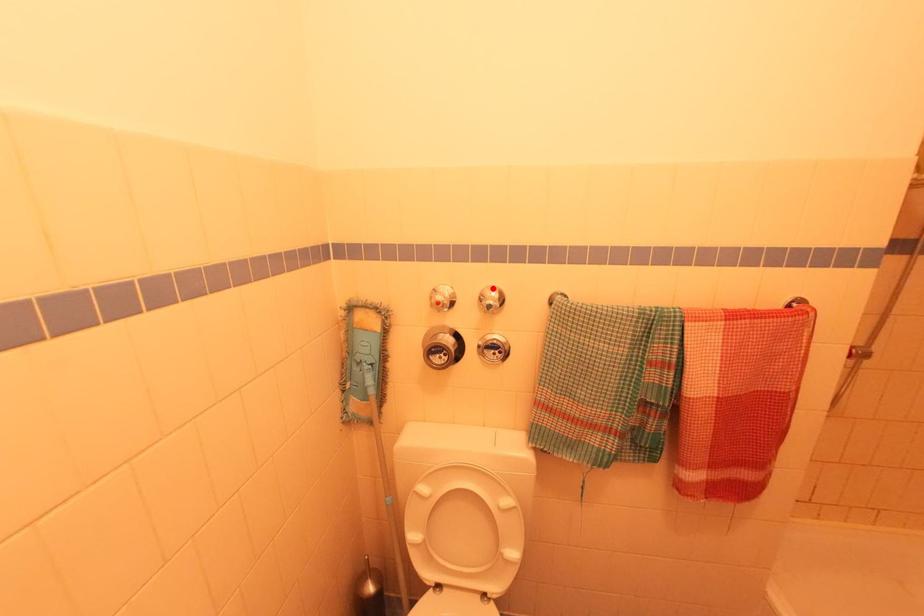
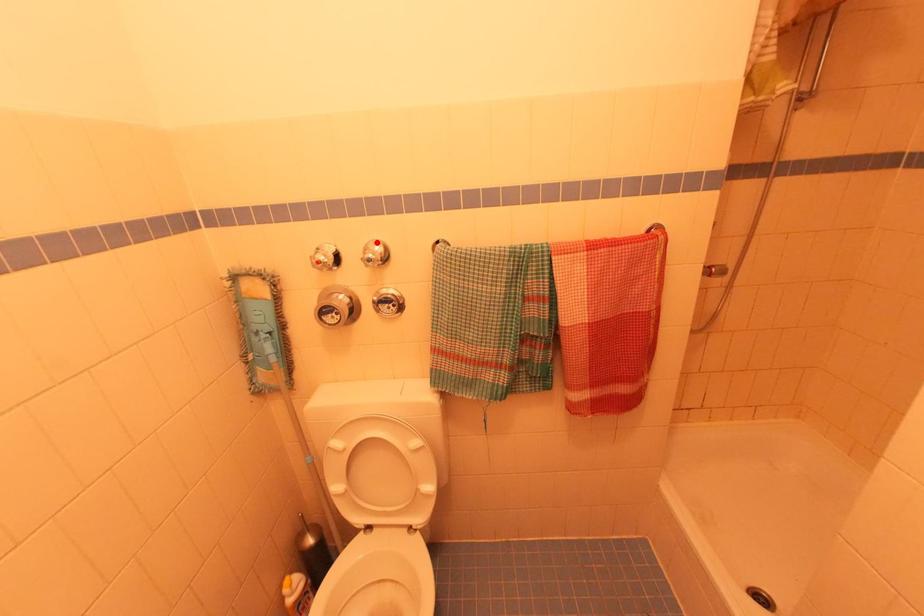
I am providing you with two images of the same scene from different viewpoints. A red point is marked on the first image and another point is marked on the second image. Is the marked point in image1 the same physical position as the marked point in image2?

Yes